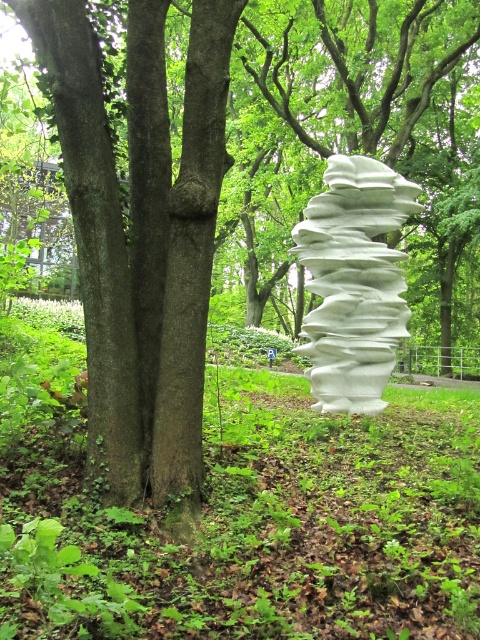
You are a visitor in the park and want to take a photo of the white matte sculpture at right and the white matte sculpture at center. Which sculpture is closer to the camera?

The white matte sculpture at right is positioned under the white matte sculpture at center, so the white matte sculpture at center is closer to the camera.

You are standing at the center of the scene and want to place a new bench. The bench must be positioned exactly at point (240,512). What object will the bench be placed next to?

The bench will be placed next to the white matte sculpture at right, as that is the object located at point (240,512).

You are standing in the park and want to place a new bench between the two points, point (120,576) and point (347,365). Which point is closer to you so the bench can be placed closer to it?

Point (120,576) is closer to the viewer than point (347,365), so the bench should be placed closer to point (120,576).